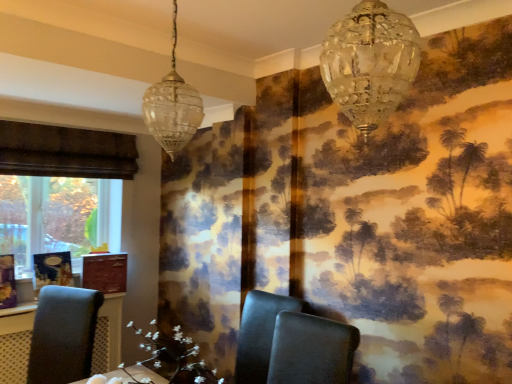
Describe the element at coordinates (176, 357) in the screenshot. The width and height of the screenshot is (512, 384). I see `white floral arrangement at center` at that location.

Find the location of `black leather chair at center, placed as the 2th chair when sorted from left to right`. black leather chair at center, placed as the 2th chair when sorted from left to right is located at coordinates (259, 334).

Locate an element on the screen. The width and height of the screenshot is (512, 384). white floral arrangement at center is located at coordinates (176, 357).

Does clear glass pendant light at upper left, which ranks as the second lamp in right-to-left order, touch crystal glass chandelier at upper center, positioned as the 2th lamp in back-to-front order?

No, clear glass pendant light at upper left, which ranks as the second lamp in right-to-left order, is not beside crystal glass chandelier at upper center, positioned as the 2th lamp in back-to-front order.

Does clear glass pendant light at upper left, the first lamp in the left-to-right sequence, lie in front of crystal glass chandelier at upper center, which is the second lamp from left to right?

No, it is behind crystal glass chandelier at upper center, which is the second lamp from left to right.

Consider the image. Which is closer to the camera, (191, 125) or (407, 23)?

The point (407, 23) is in front.

Locate an element on the screen. lamp above the crystal glass chandelier at upper center, which is the second lamp from left to right (from the image's perspective) is located at coordinates (172, 106).

In order to click on chair lying in front of the white floral arrangement at center in this screenshot , I will do `click(311, 350)`.

Can you confirm if matte dark gray chair at center, placed as the 3th chair when sorted from left to right, is taller than white floral arrangement at center?

Yes, matte dark gray chair at center, placed as the 3th chair when sorted from left to right, is taller than white floral arrangement at center.

Is matte dark gray chair at center, the first chair from the right, positioned behind white floral arrangement at center?

No, it is in front of white floral arrangement at center.

Considering the relative sizes of matte black chair at left, the third chair when ordered from right to left, and matte dark gray chair at center, the first chair from the right, in the image provided, is matte black chair at left, the third chair when ordered from right to left, smaller than matte dark gray chair at center, the first chair from the right,?

No.

From the picture: From the image's perspective, which one is positioned higher, matte black chair at left, the third chair when ordered from right to left, or matte dark gray chair at center, the first chair from the right?

From the image's view, matte dark gray chair at center, the first chair from the right, is above.

Which is in front, point (54, 382) or point (278, 313)?

The point (278, 313) is in front.

Where is `the 2nd chair located above the matte black chair at left, the 1th chair in the left-to-right sequence (from a real-world perspective)`? the 2nd chair located above the matte black chair at left, the 1th chair in the left-to-right sequence (from a real-world perspective) is located at coordinates (311, 350).

Is matte dark gray chair at center, the first chair from the right, facing away from black leather chair at center, the 2th chair viewed from the right?

That's not correct — matte dark gray chair at center, the first chair from the right, is not looking away from black leather chair at center, the 2th chair viewed from the right.

From the image's perspective, is matte dark gray chair at center, the first chair from the right, positioned above or below black leather chair at center, the 2th chair viewed from the right?

matte dark gray chair at center, the first chair from the right, is situated higher than black leather chair at center, the 2th chair viewed from the right, in the image.

Considering the positions of objects matte dark gray chair at center, the first chair from the right, and black leather chair at center, the 2th chair viewed from the right, in the image provided, who is behind, matte dark gray chair at center, the first chair from the right, or black leather chair at center, the 2th chair viewed from the right,?

Positioned behind is black leather chair at center, the 2th chair viewed from the right.

Considering the positions of point (278, 383) and point (277, 304), is point (278, 383) closer or farther from the camera than point (277, 304)?

Point (278, 383) is closer to the camera than point (277, 304).

Is white floral arrangement at center not within black leather chair at center, placed as the 2th chair when sorted from left to right?

white floral arrangement at center lies outside black leather chair at center, placed as the 2th chair when sorted from left to right,'s area.

In terms of width, does white floral arrangement at center look wider or thinner when compared to black leather chair at center, the 2th chair viewed from the right?

white floral arrangement at center is thinner than black leather chair at center, the 2th chair viewed from the right.

I want to click on the 1st chair to the right when counting from the white floral arrangement at center, so click(259, 334).

Is clear glass pendant light at upper left, the second lamp from the front, oriented towards matte black chair at left, the third chair when ordered from right to left?

No, clear glass pendant light at upper left, the second lamp from the front, is not turned towards matte black chair at left, the third chair when ordered from right to left.

Considering the relative sizes of clear glass pendant light at upper left, which ranks as the second lamp in right-to-left order, and matte black chair at left, the third chair when ordered from right to left, in the image provided, is clear glass pendant light at upper left, which ranks as the second lamp in right-to-left order, wider than matte black chair at left, the third chair when ordered from right to left,?

No, clear glass pendant light at upper left, which ranks as the second lamp in right-to-left order, is not wider than matte black chair at left, the third chair when ordered from right to left.

In terms of height, does clear glass pendant light at upper left, positioned as the 1th lamp in back-to-front order, look taller or shorter compared to matte black chair at left, the third chair when ordered from right to left?

Considering their sizes, clear glass pendant light at upper left, positioned as the 1th lamp in back-to-front order, has more height than matte black chair at left, the third chair when ordered from right to left.

From a real-world perspective, is clear glass pendant light at upper left, positioned as the 1th lamp in back-to-front order, positioned above or below matte black chair at left, the third chair when ordered from right to left?

In terms of real-world spatial position, clear glass pendant light at upper left, positioned as the 1th lamp in back-to-front order, is above matte black chair at left, the third chair when ordered from right to left.

Considering the positions of objects crystal glass chandelier at upper center, positioned as the 2th lamp in back-to-front order, and clear glass pendant light at upper left, which ranks as the second lamp in right-to-left order, in the image provided, who is more to the right, crystal glass chandelier at upper center, positioned as the 2th lamp in back-to-front order, or clear glass pendant light at upper left, which ranks as the second lamp in right-to-left order,?

Positioned to the right is crystal glass chandelier at upper center, positioned as the 2th lamp in back-to-front order.

Looking at this image, considering their positions, is crystal glass chandelier at upper center, which is counted as the first lamp, starting from the right, located in front of or behind clear glass pendant light at upper left, the second lamp from the front?

crystal glass chandelier at upper center, which is counted as the first lamp, starting from the right, is in front of clear glass pendant light at upper left, the second lamp from the front.

From the image's perspective, is crystal glass chandelier at upper center, which is the second lamp from left to right, positioned above or below clear glass pendant light at upper left, the first lamp in the left-to-right sequence?

From the image's perspective, crystal glass chandelier at upper center, which is the second lamp from left to right, appears below clear glass pendant light at upper left, the first lamp in the left-to-right sequence.

The image size is (512, 384). What are the coordinates of `lamp lying below the clear glass pendant light at upper left, the first lamp in the left-to-right sequence (from the image's perspective)` in the screenshot? It's located at (370, 63).

Find the location of a particular element. chair in front of the white floral arrangement at center is located at coordinates (311, 350).

When comparing their distances from matte dark gray chair at center, the first chair from the right, does clear glass pendant light at upper left, the second lamp from the front, or crystal glass chandelier at upper center, positioned as the 2th lamp in back-to-front order, seem closer?

clear glass pendant light at upper left, the second lamp from the front.

Looking at the image, which one is located closer to crystal glass chandelier at upper center, placed as the 1th lamp when sorted from front to back, matte dark gray chair at center, placed as the 3th chair when sorted from left to right, or clear glass pendant light at upper left, the second lamp from the front?

clear glass pendant light at upper left, the second lamp from the front, lies closer to crystal glass chandelier at upper center, placed as the 1th lamp when sorted from front to back, than the other object.

From the image, which object appears to be nearer to matte dark gray chair at center, the first chair from the right, matte black chair at left, the third chair when ordered from right to left, or crystal glass chandelier at upper center, which is the second lamp from left to right?

matte black chair at left, the third chair when ordered from right to left.

Considering their positions, is crystal glass chandelier at upper center, which is the second lamp from left to right, positioned further to matte dark gray chair at center, the first chair from the right, than black leather chair at center, the 2th chair viewed from the right?

crystal glass chandelier at upper center, which is the second lamp from left to right, is further to matte dark gray chair at center, the first chair from the right.

When comparing their distances from black leather chair at center, placed as the 2th chair when sorted from left to right, does white floral arrangement at center or matte black chair at left, the third chair when ordered from right to left, seem further?

matte black chair at left, the third chair when ordered from right to left, is positioned further to the anchor black leather chair at center, placed as the 2th chair when sorted from left to right.

From the image, which object appears to be farther from white floral arrangement at center, black leather chair at center, the 2th chair viewed from the right, or matte black chair at left, the 1th chair in the left-to-right sequence?

Among the two, black leather chair at center, the 2th chair viewed from the right, is located further to white floral arrangement at center.

Looking at this image, looking at the image, which one is located further to crystal glass chandelier at upper center, positioned as the 2th lamp in back-to-front order, white floral arrangement at center or matte dark gray chair at center, the first chair from the right?

matte dark gray chair at center, the first chair from the right.

From the image, which object appears to be farther from matte dark gray chair at center, placed as the 3th chair when sorted from left to right, black leather chair at center, placed as the 2th chair when sorted from left to right, or matte black chair at left, the third chair when ordered from right to left?

The object further to matte dark gray chair at center, placed as the 3th chair when sorted from left to right, is matte black chair at left, the third chair when ordered from right to left.

Find the location of a particular element. The image size is (512, 384). chair between matte black chair at left, the 1th chair in the left-to-right sequence, and matte dark gray chair at center, the first chair from the right, in the horizontal direction is located at coordinates (259, 334).

The image size is (512, 384). Identify the location of chair between clear glass pendant light at upper left, positioned as the 1th lamp in back-to-front order, and black leather chair at center, the 2th chair viewed from the right, from top to bottom. coord(311,350).

Locate an element on the screen. Image resolution: width=512 pixels, height=384 pixels. flower between clear glass pendant light at upper left, the first lamp in the left-to-right sequence, and matte black chair at left, the 1th chair in the left-to-right sequence, vertically is located at coordinates (176, 357).

Where is `flower between matte black chair at left, the third chair when ordered from right to left, and matte dark gray chair at center, the first chair from the right`? flower between matte black chair at left, the third chair when ordered from right to left, and matte dark gray chair at center, the first chair from the right is located at coordinates (176, 357).